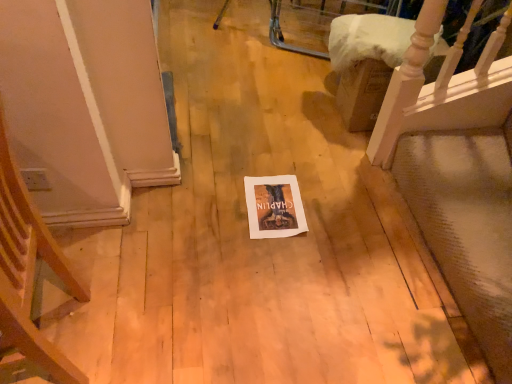
At what (x,y) coordinates should I click in order to perform the action: click on vacant area on top of white paper at center (from a real-world perspective). Please return your answer as a coordinate pair (x, y). Looking at the image, I should click on (278, 200).